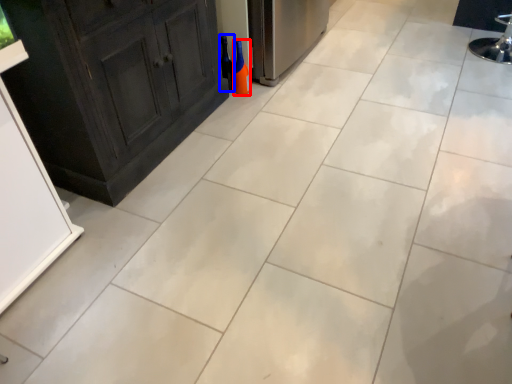
Question: Which of the following is the farthest to the observer, bottle (highlighted by a red box) or wine bottle (highlighted by a blue box)?

Choices:
 (A) bottle
 (B) wine bottle

Answer: (B)